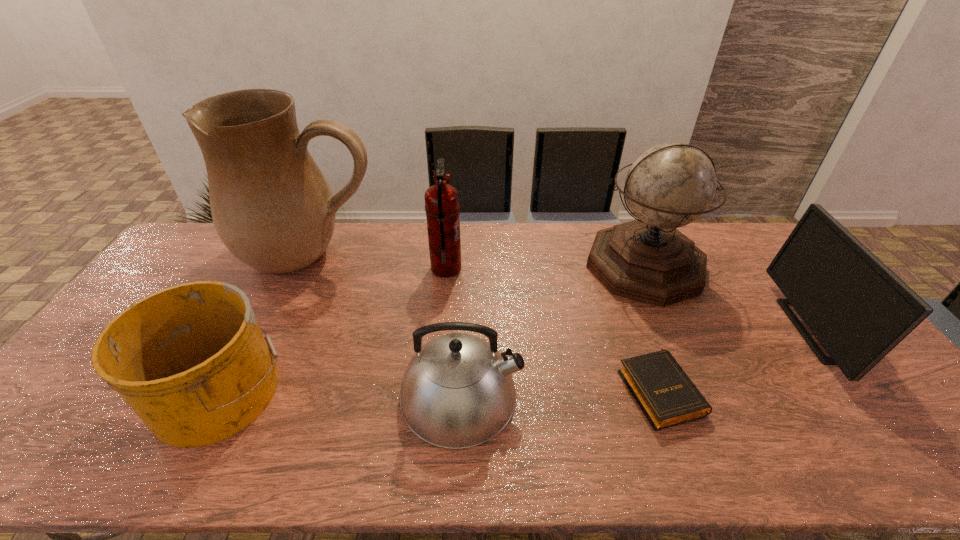
The width and height of the screenshot is (960, 540). Identify the location of bucket that is positioned at the near edge. [191, 361].

I want to click on object located at the right edge, so click(859, 310).

Where is `free location at the far edge`? The image size is (960, 540). free location at the far edge is located at coordinates (590, 232).

This screenshot has width=960, height=540. I want to click on vacant area at the near edge of the desktop, so click(x=622, y=456).

The image size is (960, 540). In the image, there is a desktop. What are the coordinates of `free space at the left edge` in the screenshot? It's located at (192, 271).

You are a GUI agent. You are given a task and a screenshot of the screen. Output one action in this format:
    pyautogui.click(x=<x>, y=<y>)
    Task: Click on the vacant space at the far right corner of the desktop
    The width and height of the screenshot is (960, 540).
    Given the screenshot: What is the action you would take?
    pyautogui.click(x=732, y=231)

Find the location of a particular element. empty location between the tallest object and the globe is located at coordinates (478, 261).

Where is `free space between the cream pitcher and the computer monitor`? free space between the cream pitcher and the computer monitor is located at coordinates click(x=566, y=293).

Where is `vacant point located between the rightmost object and the shortest object`? vacant point located between the rightmost object and the shortest object is located at coordinates (740, 360).

Locate an element on the screen. empty space that is in between the third tallest object and the shortest object is located at coordinates (553, 329).